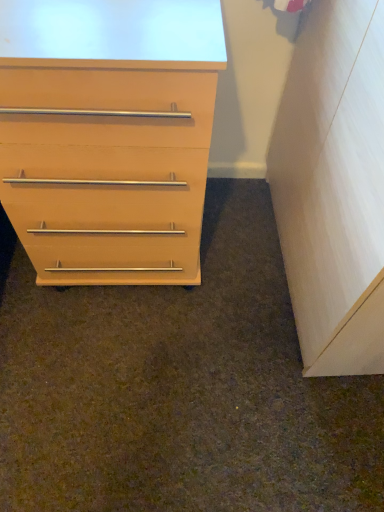
Question: From the image's perspective, is light wood/file cabinet at right above or below matte wood chest of drawers at left?

Choices:
 (A) below
 (B) above

Answer: (A)

Question: Based on their sizes in the image, would you say light wood/file cabinet at right is bigger or smaller than matte wood chest of drawers at left?

Choices:
 (A) small
 (B) big

Answer: (A)

Question: Considering the positions of point (309, 37) and point (4, 184), is point (309, 37) closer or farther from the camera than point (4, 184)?

Choices:
 (A) farther
 (B) closer

Answer: (A)

Question: From their relative heights in the image, would you say matte wood chest of drawers at left is taller or shorter than light wood/file cabinet at right?

Choices:
 (A) short
 (B) tall

Answer: (A)

Question: Considering their positions, is matte wood chest of drawers at left located in front of or behind light wood/file cabinet at right?

Choices:
 (A) behind
 (B) front

Answer: (A)

Question: From the image's perspective, is matte wood chest of drawers at left above or below light wood/file cabinet at right?

Choices:
 (A) above
 (B) below

Answer: (A)

Question: In terms of width, does matte wood chest of drawers at left look wider or thinner when compared to light wood/file cabinet at right?

Choices:
 (A) wide
 (B) thin

Answer: (A)